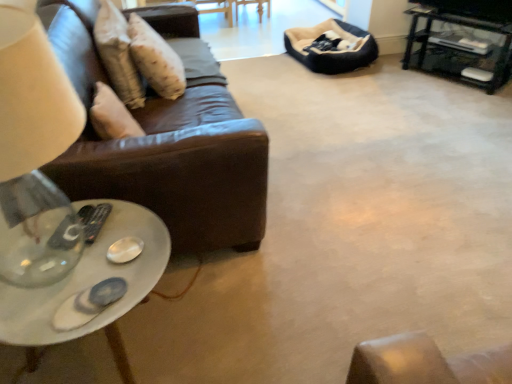
Image resolution: width=512 pixels, height=384 pixels. In order to click on free point below white glossy coffee table at lower left (from a real-world perspective) in this screenshot , I will do `click(133, 342)`.